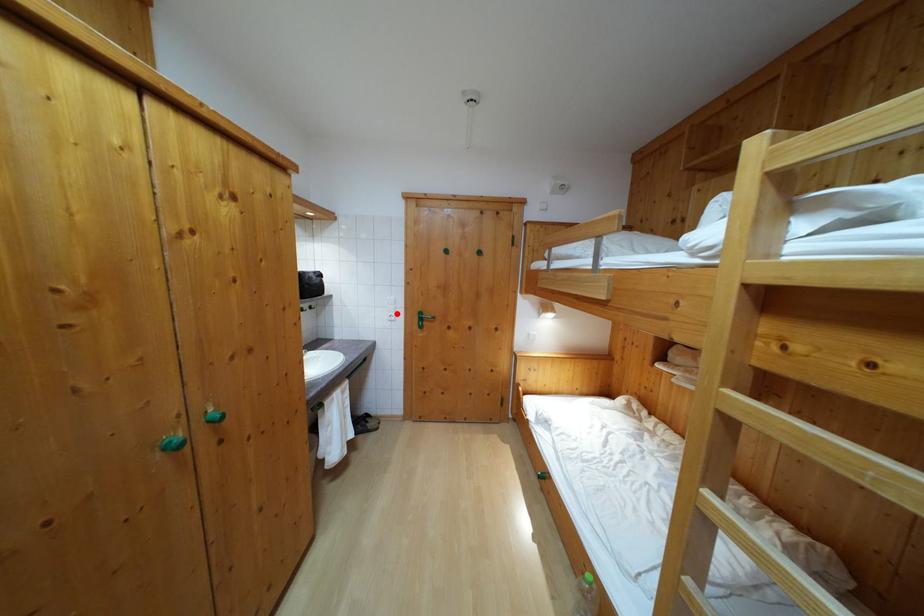
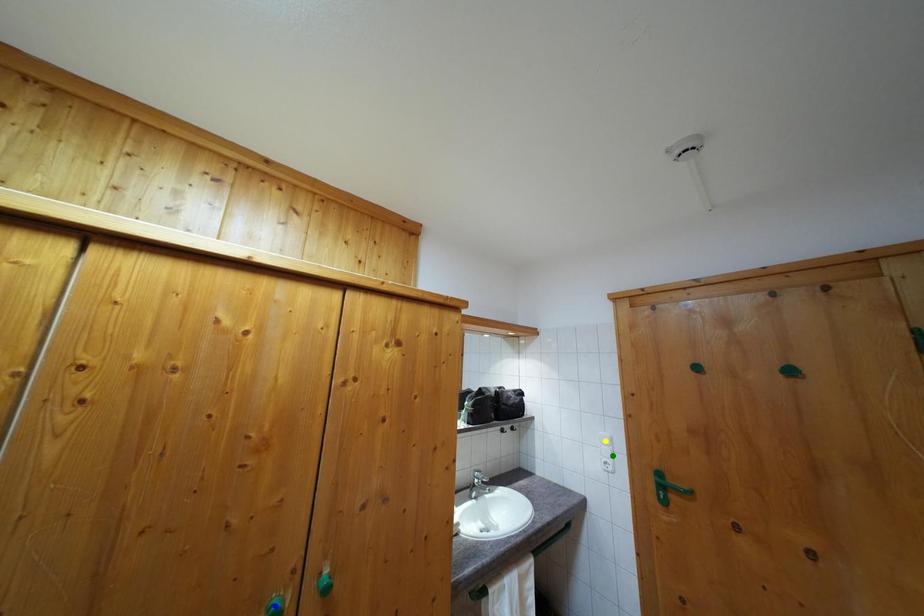
Question: I am providing you with two images of the same scene from different viewpoints. A red point is marked on the first image. You are given multiple points on the second image. Which point in image 2 is actually the same real-world point as the red point in image 1?

Choices:
 (A) yellow point
 (B) blue point
 (C) green point

Answer: (C)